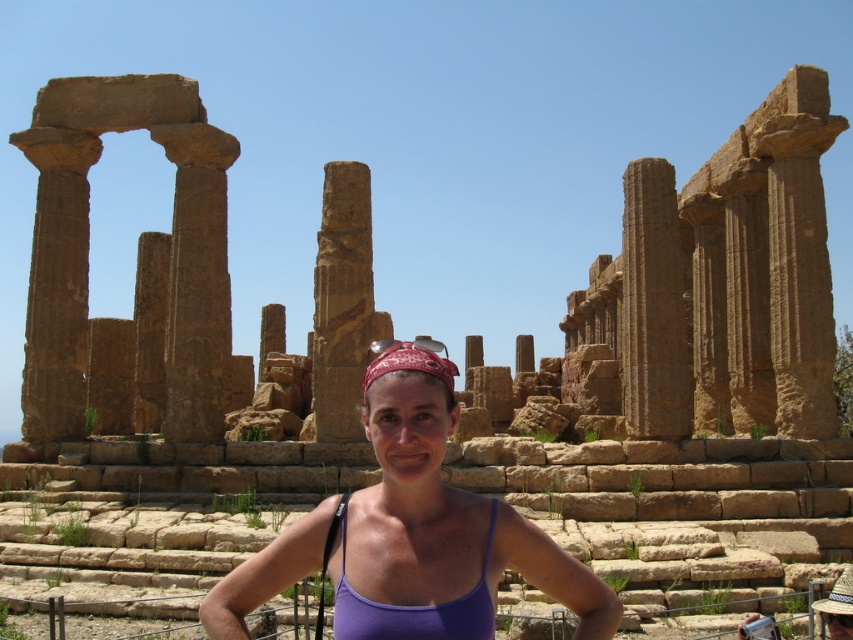
Question: Which object is farther from the camera taking this photo?

Choices:
 (A) brown stone column at center
 (B) red bandana at center
 (C) purple fabric at center

Answer: (A)

Question: Based on their relative distances, which object is farther from the red bandana at center?

Choices:
 (A) purple fabric at center
 (B) brown stone column at center

Answer: (B)

Question: Does purple fabric at center have a smaller size compared to brown stone column at center?

Choices:
 (A) no
 (B) yes

Answer: (B)

Question: Where is purple fabric at center located in relation to red bandana at center in the image?

Choices:
 (A) left
 (B) right

Answer: (A)

Question: Is purple fabric at center bigger than brown stone column at center?

Choices:
 (A) no
 (B) yes

Answer: (A)

Question: Estimate the real-world distances between objects in this image. Which object is closer to the brown stone column at center?

Choices:
 (A) red bandana at center
 (B) purple fabric at center

Answer: (A)